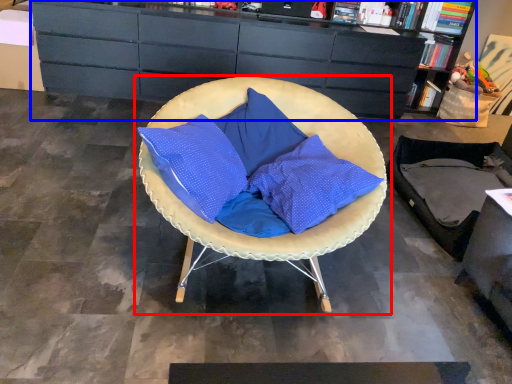
Question: Which object is closer to the camera taking this photo, chair (highlighted by a red box) or cabinetry (highlighted by a blue box)?

Choices:
 (A) chair
 (B) cabinetry

Answer: (A)